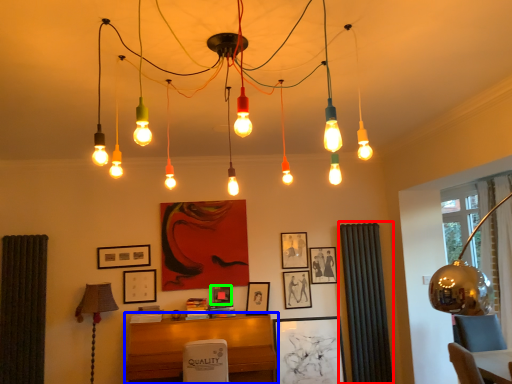
Question: Considering the real-world distances, which object is closest to curtain (highlighted by a red box)? furniture (highlighted by a blue box) or picture frame (highlighted by a green box).

Choices:
 (A) furniture
 (B) picture frame

Answer: (A)